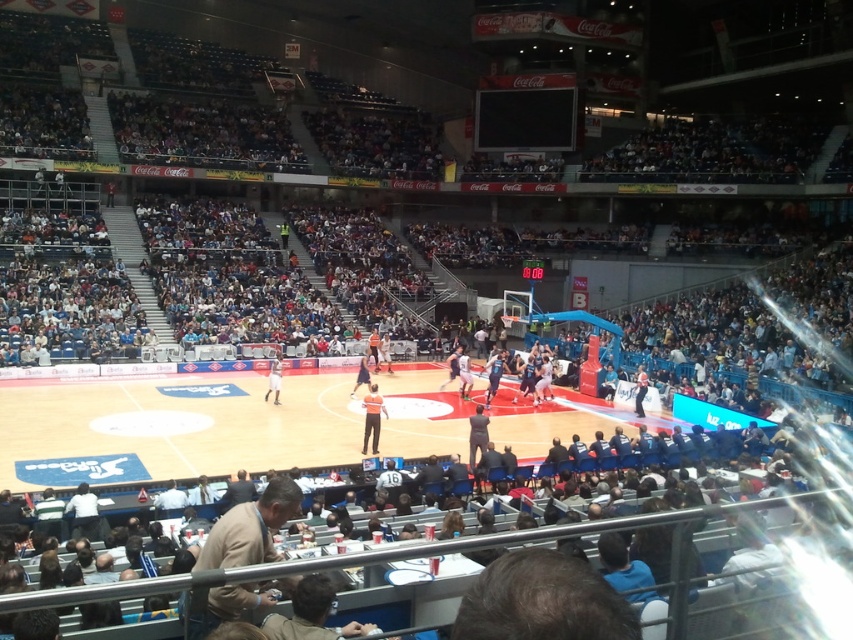
Question: Is wooden basketball court at center below orange uniform at center?

Choices:
 (A) yes
 (B) no

Answer: (A)

Question: Which point is farther to the camera?

Choices:
 (A) (273, 396)
 (B) (219, 564)
 (C) (376, 420)
 (D) (126, 432)

Answer: (A)

Question: Which is nearer to the orange uniform at center?

Choices:
 (A) wooden basketball court at center
 (B) white jersey at center
 (C) smooth black basketball at center

Answer: (A)

Question: From the image, what is the correct spatial relationship of wooden basketball court at center in relation to tan leather jacket at lower left?

Choices:
 (A) above
 (B) below

Answer: (B)

Question: Which of the following is the closest to the observer?

Choices:
 (A) tan leather jacket at lower left
 (B) orange uniform at center

Answer: (A)

Question: Observing the image, what is the correct spatial positioning of wooden basketball court at center in reference to white jersey at center?

Choices:
 (A) left
 (B) right

Answer: (B)